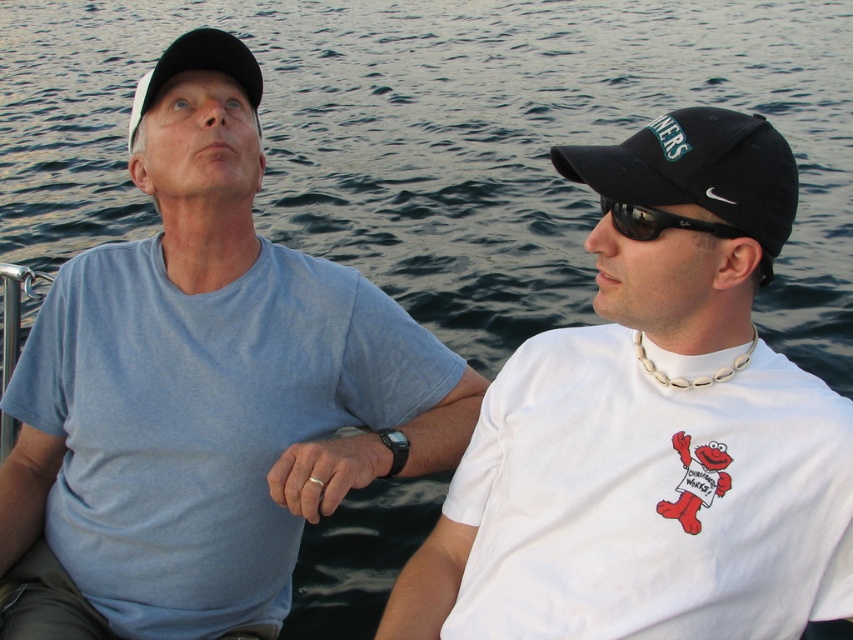
Question: Can you confirm if white matte baseball cap at upper left is positioned below black reflective sunglasses at upper right?

Choices:
 (A) yes
 (B) no

Answer: (B)

Question: Does matte blue t-shirt at left appear under white matte baseball cap at upper left?

Choices:
 (A) no
 (B) yes

Answer: (B)

Question: Which point appears farthest from the camera in this image?

Choices:
 (A) (132, 99)
 (B) (802, 310)

Answer: (A)

Question: Can you confirm if matte blue t-shirt at left is positioned below white matte t-shirt at center?

Choices:
 (A) no
 (B) yes

Answer: (A)

Question: Which is nearer to the white matte t-shirt at center?

Choices:
 (A) white matte baseball cap at upper left
 (B) black reflective sunglasses at upper right

Answer: (B)

Question: Which point is closer to the camera?

Choices:
 (A) (817, 390)
 (B) (257, 156)
 (C) (158, 81)

Answer: (A)